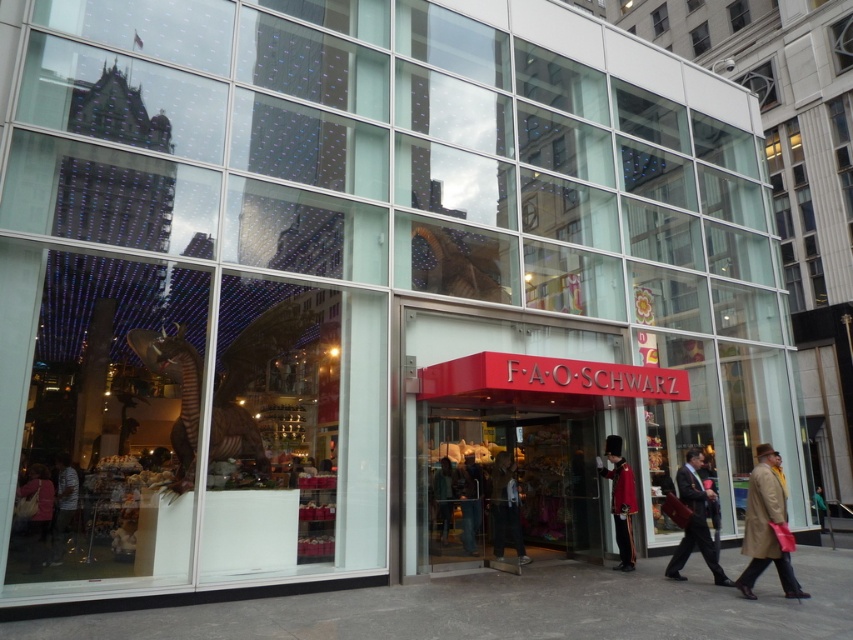
From the picture: Which of these two, shiny red uniform at center or striped shirt at lower left, stands taller?

shiny red uniform at center is taller.

The width and height of the screenshot is (853, 640). In order to click on shiny red uniform at center in this screenshot , I will do `click(619, 499)`.

Which of these two, brown leather coat at lower right or denim jeans at center, stands taller?

brown leather coat at lower right

The width and height of the screenshot is (853, 640). Describe the element at coordinates (764, 525) in the screenshot. I see `brown leather coat at lower right` at that location.

Is point (747, 538) positioned behind point (463, 509)?

No, (747, 538) is closer to viewer.

Find the location of a particular element. brown leather coat at lower right is located at coordinates (764, 525).

Does dark gray suit at center have a smaller size compared to denim jeans at center?

Indeed, dark gray suit at center has a smaller size compared to denim jeans at center.

Which is below, dark gray suit at center or denim jeans at center?

denim jeans at center is below.

At what (x,y) coordinates should I click in order to perform the action: click on dark gray suit at center. Please return your answer as a coordinate pair (x, y). Image resolution: width=853 pixels, height=640 pixels. Looking at the image, I should click on (506, 508).